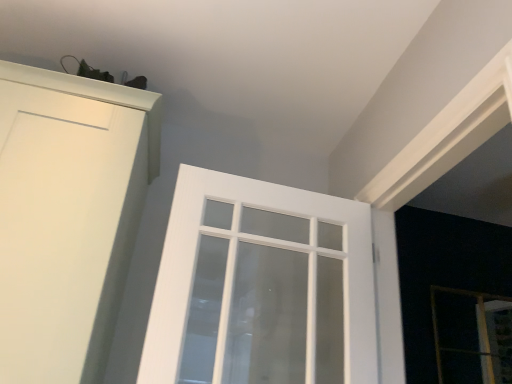
Question: From the image's perspective, relative to transparent glass screen door at lower right, is white textured glass door at center above or below?

Choices:
 (A) below
 (B) above

Answer: (B)

Question: Does point (222, 284) appear closer or farther from the camera than point (499, 294)?

Choices:
 (A) closer
 (B) farther

Answer: (A)

Question: In terms of width, does white textured glass door at center look wider or thinner when compared to transparent glass screen door at lower right?

Choices:
 (A) wide
 (B) thin

Answer: (A)

Question: Looking at their shapes, would you say transparent glass screen door at lower right is wider or thinner than white textured glass door at center?

Choices:
 (A) wide
 (B) thin

Answer: (B)

Question: In the image, is transparent glass screen door at lower right positioned in front of or behind white textured glass door at center?

Choices:
 (A) front
 (B) behind

Answer: (B)

Question: Does point (436, 319) appear closer or farther from the camera than point (233, 377)?

Choices:
 (A) farther
 (B) closer

Answer: (A)

Question: From a real-world perspective, relative to white textured glass door at center, is transparent glass screen door at lower right vertically above or below?

Choices:
 (A) above
 (B) below

Answer: (A)